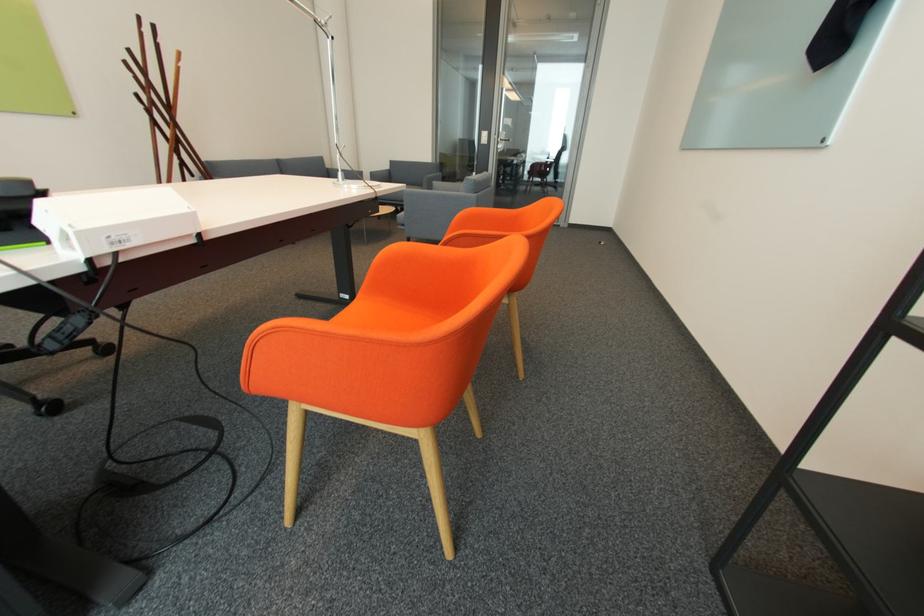
Find where to resting arm the sofa armrest. Please return your answer as a coordinate pair (x, y).

(424, 191)